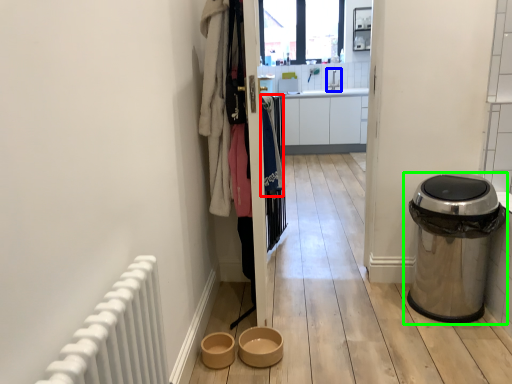
Question: Estimate the real-world distances between objects in this image. Which object is farther from clothing (highlighted by a red box), sink (highlighted by a blue box) or waste container (highlighted by a green box)?

Choices:
 (A) sink
 (B) waste container

Answer: (A)